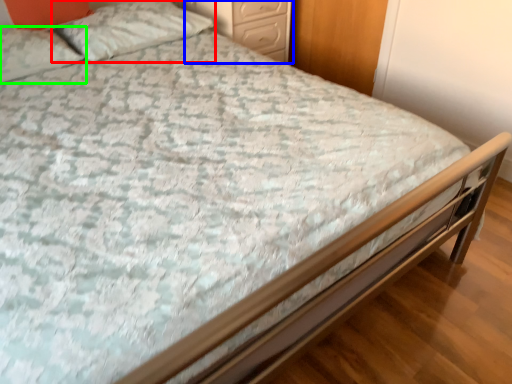
Question: Based on their relative distances, which object is nearer to pillow (highlighted by a red box)? Choose from nightstand (highlighted by a blue box) and pillow (highlighted by a green box).

Choices:
 (A) nightstand
 (B) pillow

Answer: (B)